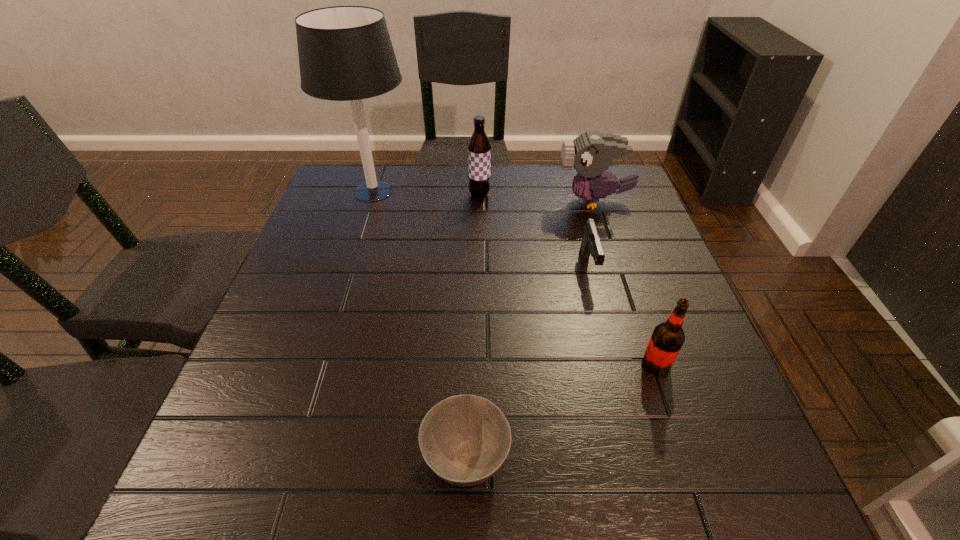
The width and height of the screenshot is (960, 540). Identify the location of root beer positioned at the far edge. (479, 148).

I want to click on bird positioned at the far edge, so click(591, 153).

Where is `object situated at the near edge`? object situated at the near edge is located at coordinates (465, 439).

Where is `object that is at the left edge`? The height and width of the screenshot is (540, 960). object that is at the left edge is located at coordinates (345, 53).

Where is `bird at the right edge`? bird at the right edge is located at coordinates (591, 153).

The width and height of the screenshot is (960, 540). What are the coordinates of `root beer at the right edge` in the screenshot? It's located at (667, 338).

The height and width of the screenshot is (540, 960). In order to click on object at the far left corner in this screenshot , I will do `click(345, 53)`.

The width and height of the screenshot is (960, 540). In order to click on object that is at the far right corner in this screenshot , I will do `click(591, 153)`.

Image resolution: width=960 pixels, height=540 pixels. I want to click on blank space at the far edge, so click(445, 195).

You are a GUI agent. You are given a task and a screenshot of the screen. Output one action in this format:
    pyautogui.click(x=<x>, y=<y>)
    Task: Click on the vacant area at the near edge of the desktop
    This screenshot has height=540, width=960.
    Given the screenshot: What is the action you would take?
    pyautogui.click(x=288, y=505)